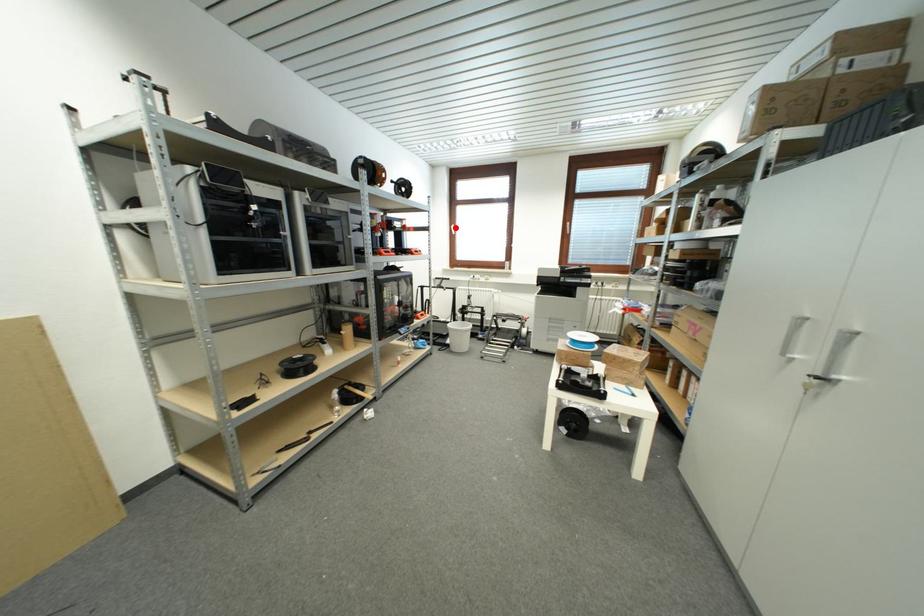
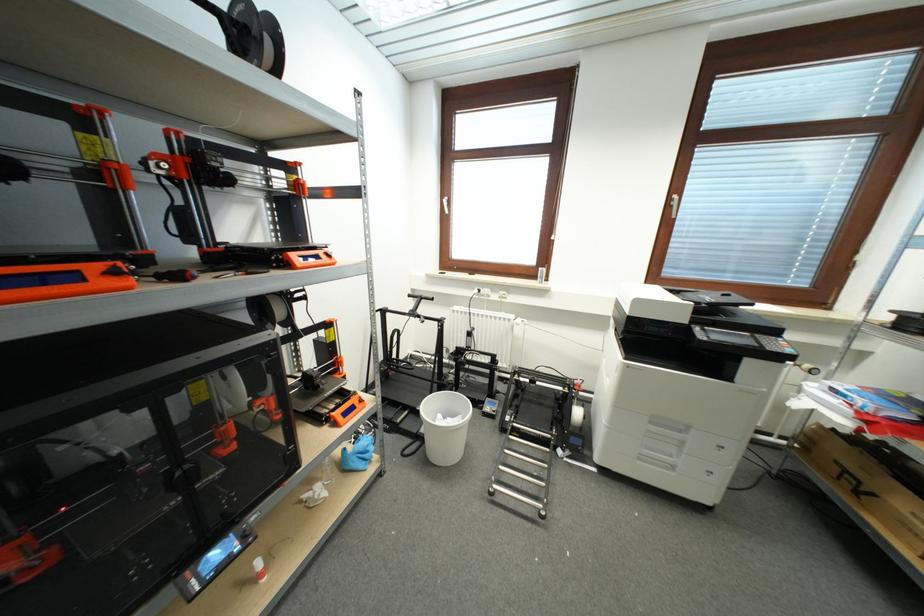
Locate, in the second image, the point that corresponds to the highlighted location in the first image.

(446, 200)